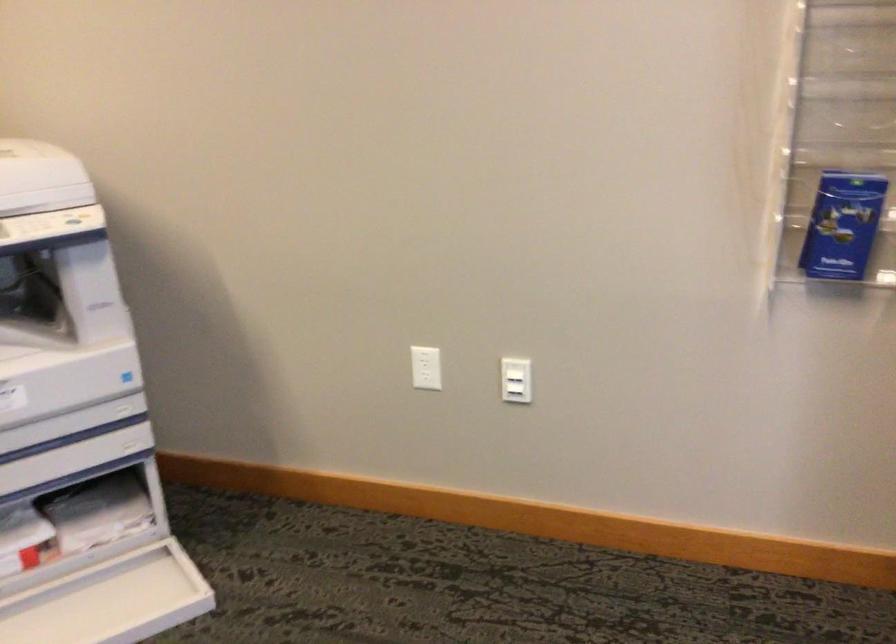
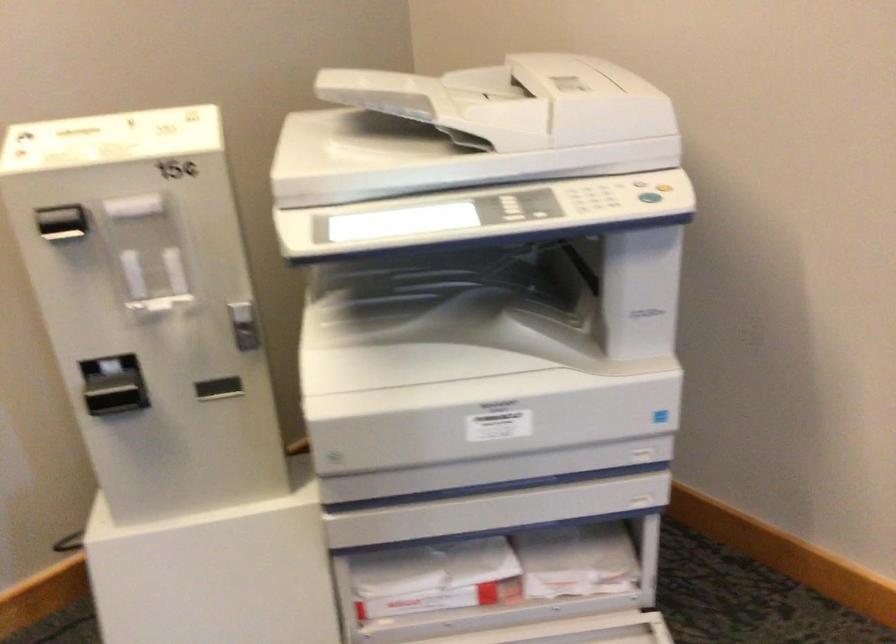
In the second image, find the point that corresponds to [88,221] in the first image.

(649, 196)